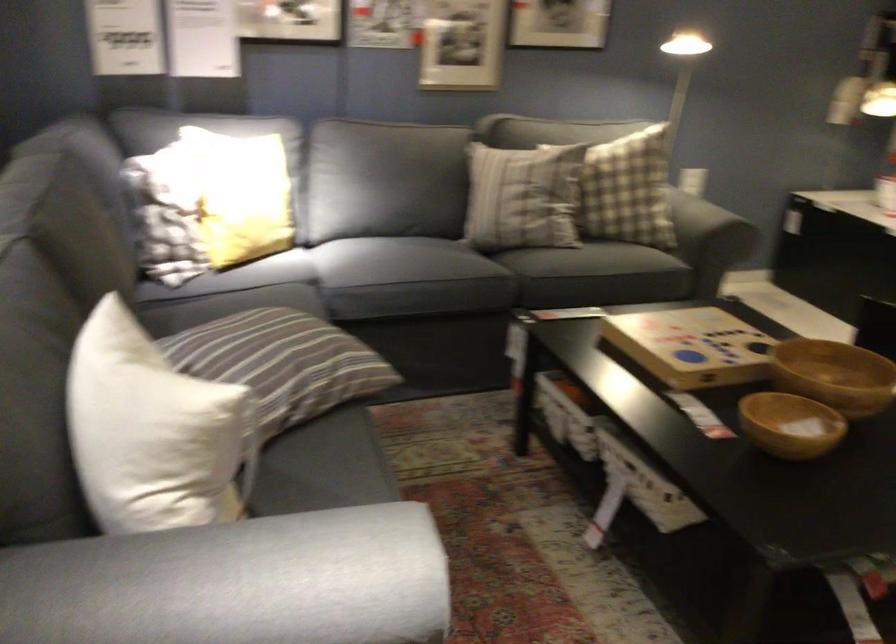
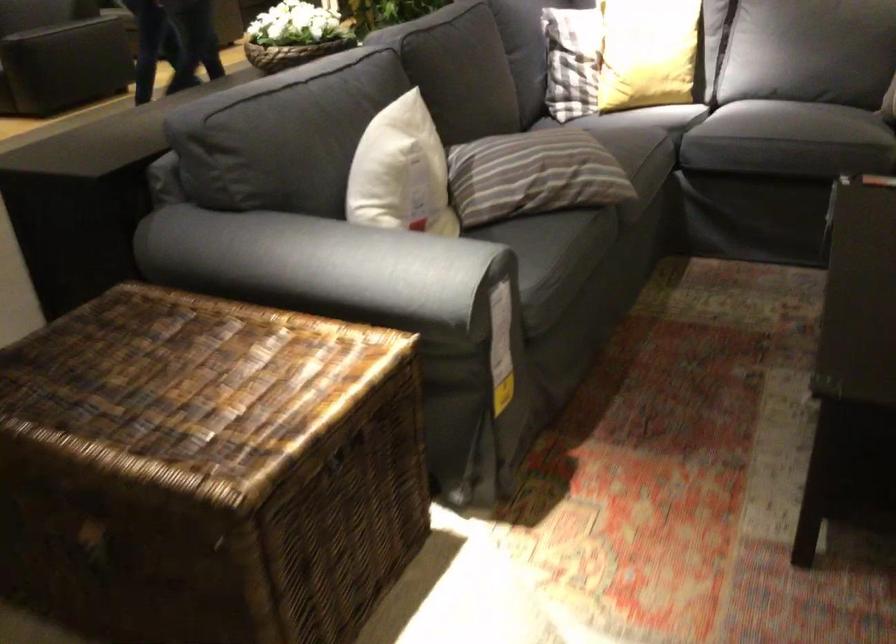
Locate, in the second image, the point that corresponds to [290,368] in the first image.

(533, 174)